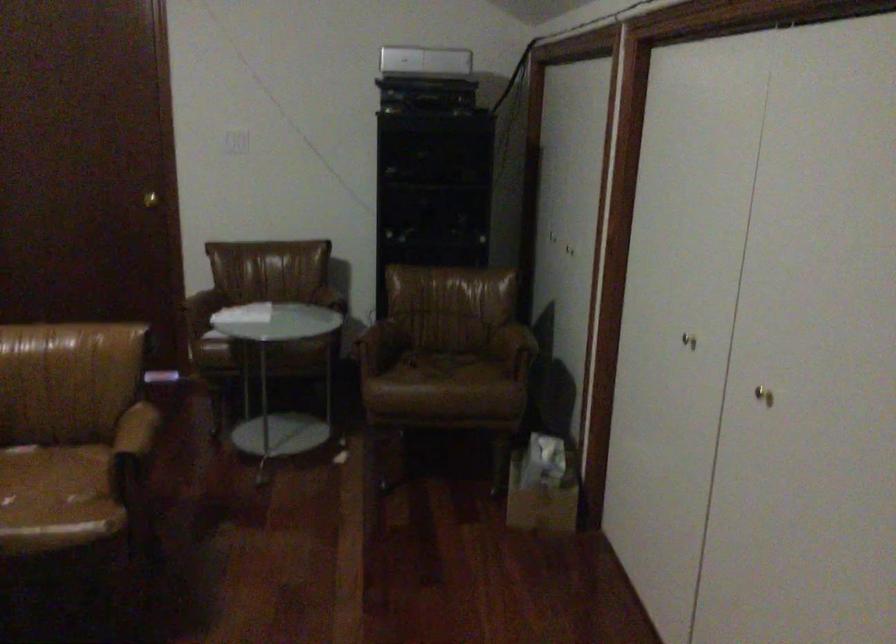
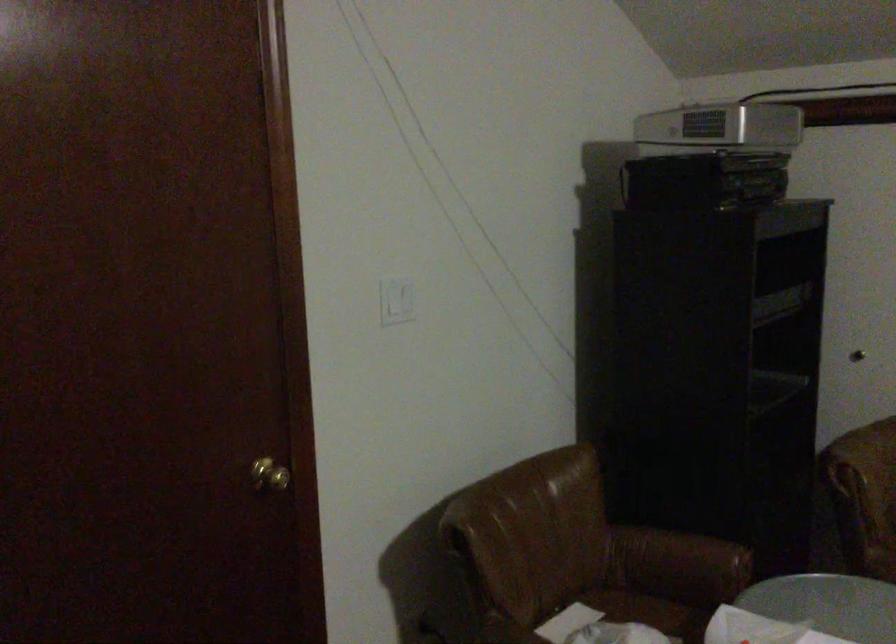
Find the pixel in the second image that matches the point at 235,129 in the first image.

(397, 301)